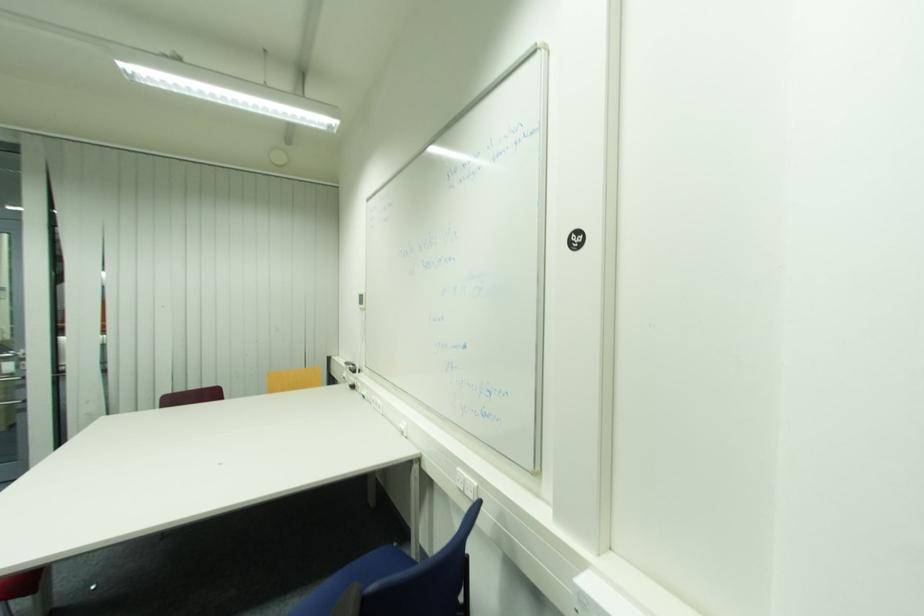
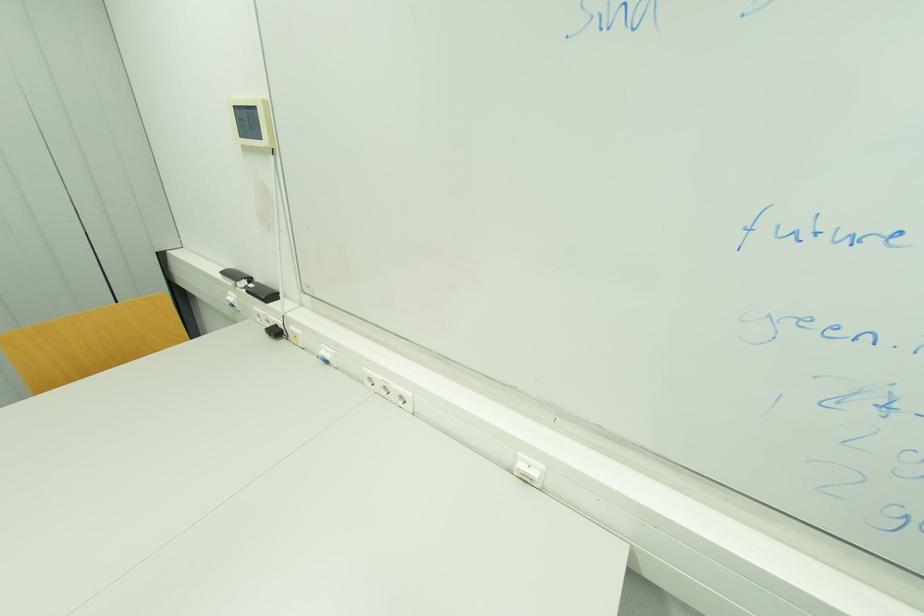
Find the pixel in the second image that matches (357,387) in the first image.

(281, 333)